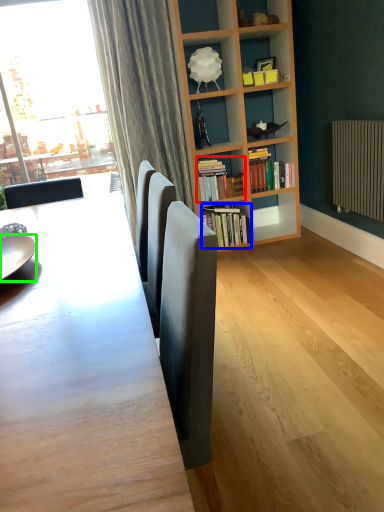
Question: Considering the real-world distances, which object is closest to book (highlighted by a red box)? book (highlighted by a blue box) or plate (highlighted by a green box).

Choices:
 (A) book
 (B) plate

Answer: (A)